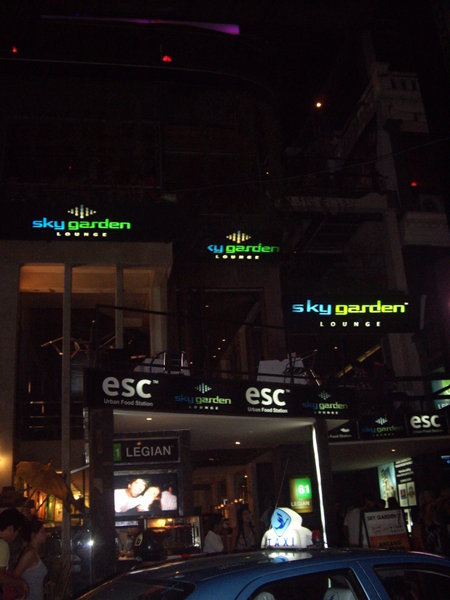
Where is `window`? The image size is (450, 600). window is located at coordinates (391, 587).